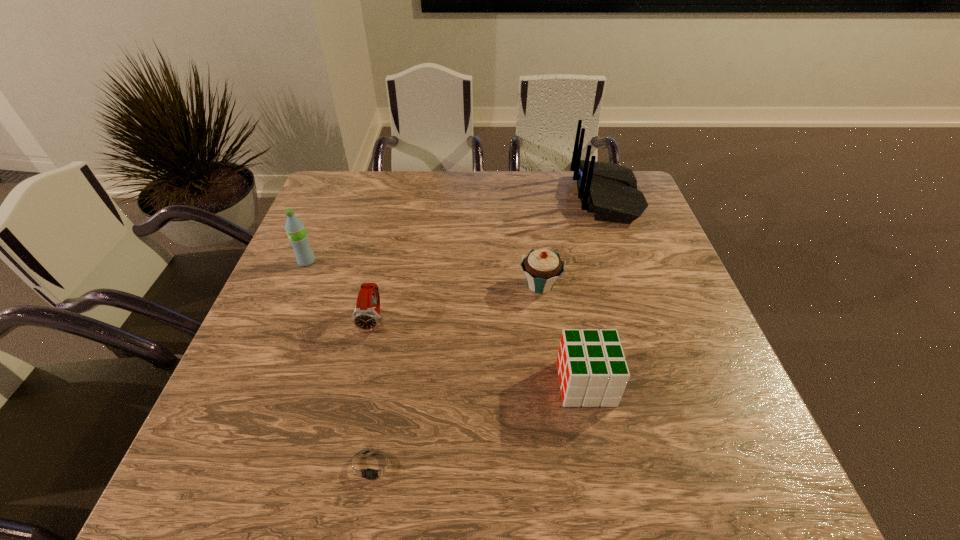
Find the location of `vacant space located 0.060m on the back of the farthest object`. vacant space located 0.060m on the back of the farthest object is located at coordinates (555, 197).

You are a GUI agent. You are given a task and a screenshot of the screen. Output one action in this format:
    pyautogui.click(x=<x>, y=<y>)
    Task: Click on the vacant region located on the back of the farthest object
    The image size is (960, 540).
    Given the screenshot: What is the action you would take?
    pyautogui.click(x=475, y=197)

I want to click on vacant space located 0.360m on the back of the farthest object, so click(x=459, y=197).

Where is `vacant space located 0.340m on the right of the second tallest object`? The width and height of the screenshot is (960, 540). vacant space located 0.340m on the right of the second tallest object is located at coordinates (444, 261).

The height and width of the screenshot is (540, 960). I want to click on free space located 0.310m on the left of the cupcake, so click(x=394, y=285).

Find the location of a particular element. The image size is (960, 540). vacant position located on the red face of the cube is located at coordinates (495, 383).

Locate an element on the screen. This screenshot has height=540, width=960. vacant position located 0.360m on the red face of the cube is located at coordinates (382, 383).

The image size is (960, 540). Identify the location of vacant region located 0.090m on the red face of the cube. (x=515, y=383).

You are a GUI agent. You are given a task and a screenshot of the screen. Output one action in this format:
    pyautogui.click(x=<x>, y=<y>)
    Task: Click on the vacant space located 0.120m on the face of the farther watch
    This screenshot has width=960, height=540.
    Given the screenshot: What is the action you would take?
    pyautogui.click(x=360, y=384)

Where is `object located at the far edge`? object located at the far edge is located at coordinates (608, 190).